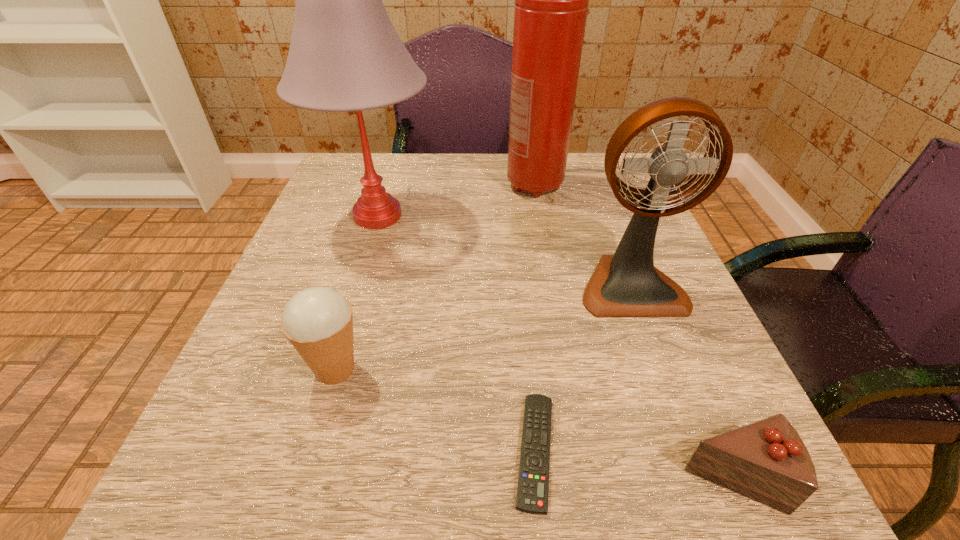
This screenshot has width=960, height=540. What are the coordinates of `free space located on the front-facing side of the third tallest object` in the screenshot? It's located at (651, 341).

You are a GUI agent. You are given a task and a screenshot of the screen. Output one action in this format:
    pyautogui.click(x=<x>, y=<y>)
    Task: Click on the free space located 0.240m on the back of the icecream
    Image resolution: width=960 pixels, height=540 pixels.
    Given the screenshot: What is the action you would take?
    pyautogui.click(x=371, y=251)

Locate an element on the screen. free space located on the left of the second shortest object is located at coordinates (572, 476).

This screenshot has width=960, height=540. What are the coordinates of `free space located on the back of the shortest object` in the screenshot? It's located at (524, 338).

I want to click on fire extinguisher located at the far edge, so click(x=551, y=0).

Locate an element on the screen. table lamp located at the far edge is located at coordinates (345, 55).

What are the coordinates of `chocolate cake that is at the near edge` in the screenshot? It's located at (767, 461).

At what (x,y) coordinates should I click in order to perform the action: click on remote control situated at the near edge. Please return your answer as a coordinate pair (x, y). The width and height of the screenshot is (960, 540). Looking at the image, I should click on (533, 480).

Locate an element on the screen. The height and width of the screenshot is (540, 960). table lamp that is at the left edge is located at coordinates (345, 55).

Identify the location of icecream located in the left edge section of the desktop. The width and height of the screenshot is (960, 540). (318, 321).